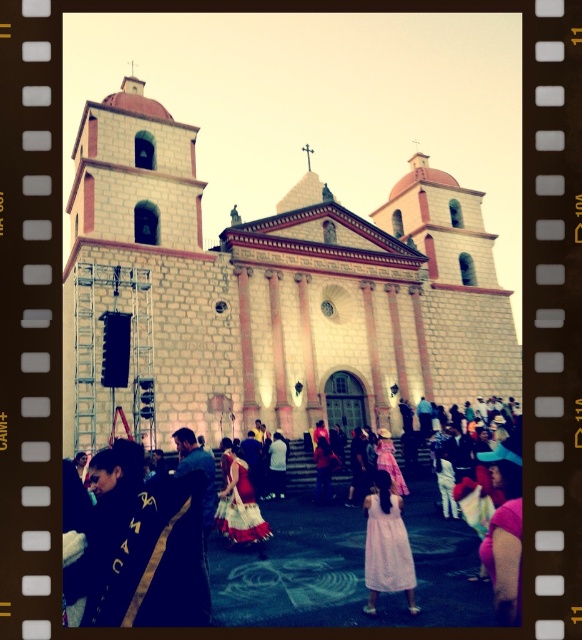
You are a photographer at the event and want to capture both the white lace dress at center and the red satin dress at center in a single frame. Given that your camera has a fixed focus, which dress should you prioritize to ensure it appears clearer in the photo?

The white lace dress at center has a larger width than the red satin dress at center, so you should prioritize focusing on the white lace dress at center to ensure it appears clearer in the photo.

You are standing in front of the historic church and want to take a photo of the crowd. You notice a white lace dress at center. Based on its position, can you estimate where in the frame this dress would appear?

The white lace dress at center is located at point (388,548), which means it is positioned towards the lower right of the frame.

Based on the photo, you are standing in front of the historic church with two bell towers. You see a white lace dress at center and a point marked at coordinates (388, 548). Can you determine if the white lace dress at center is exactly at that point?

The white lace dress at center is located at point (388, 548), so yes, the white lace dress at center is exactly at that point.